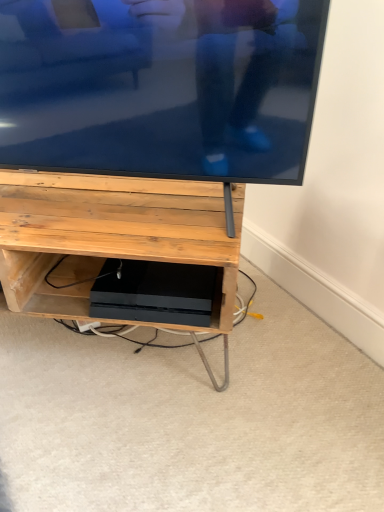
Question: From the image's perspective, is matte black tv at upper center positioned above or below black matte console at center?

Choices:
 (A) below
 (B) above

Answer: (B)

Question: Is matte black tv at upper center in front of or behind black matte console at center in the image?

Choices:
 (A) behind
 (B) front

Answer: (B)

Question: Considering the real-world distances, which object is farthest from the matte black tv at upper center?

Choices:
 (A) matte wood shelf at center
 (B) black matte console at center

Answer: (B)

Question: Estimate the real-world distances between objects in this image. Which object is farther from the matte wood shelf at center?

Choices:
 (A) black matte console at center
 (B) matte black tv at upper center

Answer: (B)